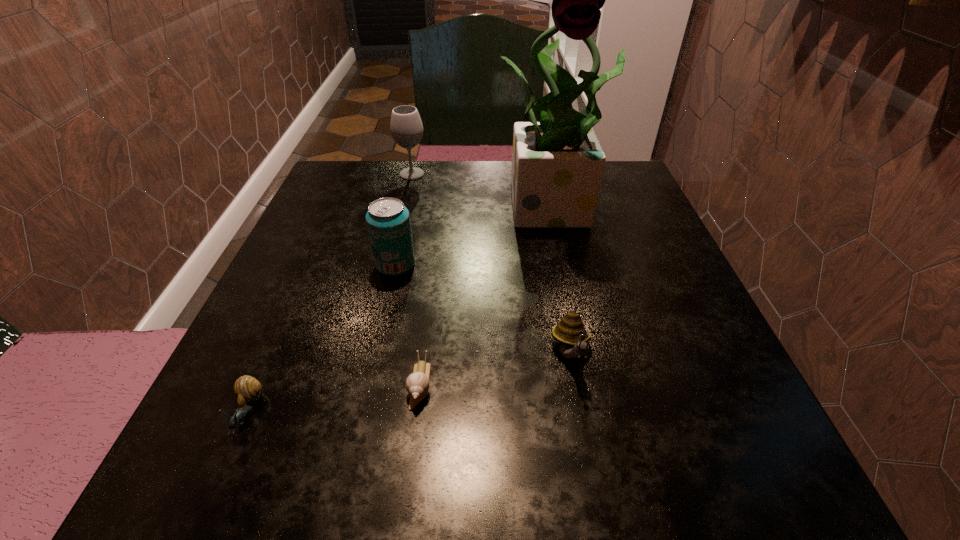
Image resolution: width=960 pixels, height=540 pixels. What are the coordinates of `blank space located 0.210m on the front-facing side of the tallest object` in the screenshot? It's located at (583, 315).

Where is `vacant space situated on the left of the second tallest object`? Image resolution: width=960 pixels, height=540 pixels. vacant space situated on the left of the second tallest object is located at coordinates (336, 174).

Locate an element on the screen. This screenshot has height=540, width=960. free spot located 0.320m on the front of the third farthest object is located at coordinates (357, 442).

Image resolution: width=960 pixels, height=540 pixels. I want to click on free space located on the face of the tallest escargot, so click(600, 500).

In order to click on free space located 0.090m on the shell of the second escargot from right to left in this screenshot , I will do `click(409, 476)`.

Find the location of `flower arrangement located in the far edge section of the desktop`. flower arrangement located in the far edge section of the desktop is located at coordinates (557, 163).

This screenshot has height=540, width=960. What are the coordinates of `wineglass present at the far edge` in the screenshot? It's located at (406, 128).

Find the location of a particular element. The image size is (960, 540). object present at the near edge is located at coordinates (247, 389).

I want to click on object situated at the left edge, so click(247, 389).

Locate an element on the screen. This screenshot has height=540, width=960. object that is positioned at the right edge is located at coordinates coord(557,163).